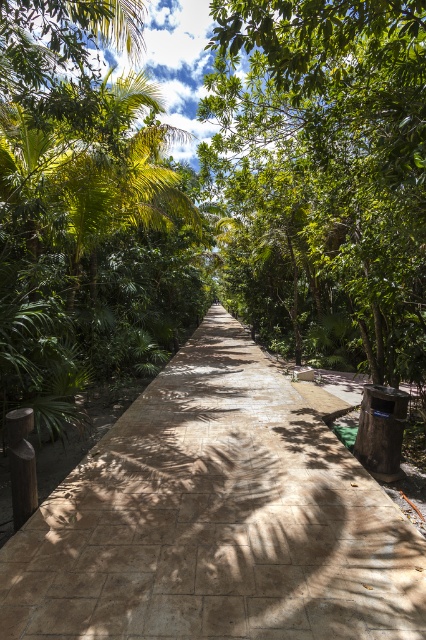
You are standing at the starting point of the pathway and want to reach a destination located at point [270,227]. There is another point at [267,440] along the way. Which point should you pass first?

You should pass point [267,440] first because it is in front of point [270,227] on the pathway.

You are standing on the brown stone pavement at center and looking towards the green leafy tree at center. Which object takes up more visual space in your view?

The green leafy tree at center occupies more visual space than the brown stone pavement at center.

You are standing on the brown stone pavement at center and want to walk towards the green leafy tree at center. Which direction should you move?

You should move to the right because the brown stone pavement at center is to the left of the green leafy tree at center, so moving right will take you towards it.